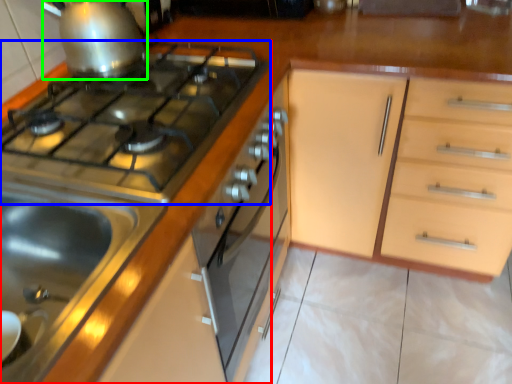
Question: Which object is positioned closest to kitchen appliance (highlighted by a red box)? Select from gas stove (highlighted by a blue box) and kitchen appliance (highlighted by a green box).

Choices:
 (A) gas stove
 (B) kitchen appliance

Answer: (A)